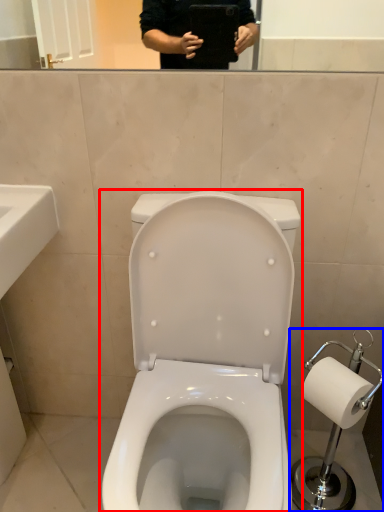
Question: Which of the following is the farthest to the observer, toilet (highlighted by a red box) or scale (highlighted by a blue box)?

Choices:
 (A) toilet
 (B) scale

Answer: (B)